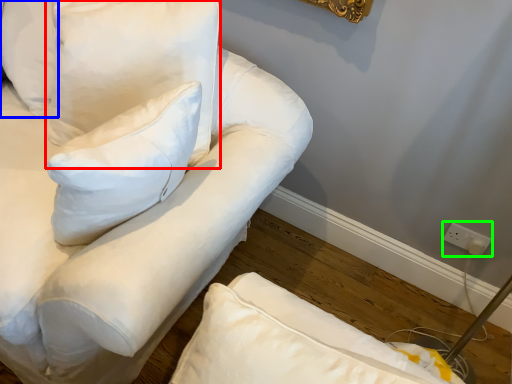
Question: Which object is positioned farthest from pillow (highlighted by a red box)? Select from pillow (highlighted by a blue box) and electric outlet (highlighted by a green box).

Choices:
 (A) pillow
 (B) electric outlet

Answer: (B)